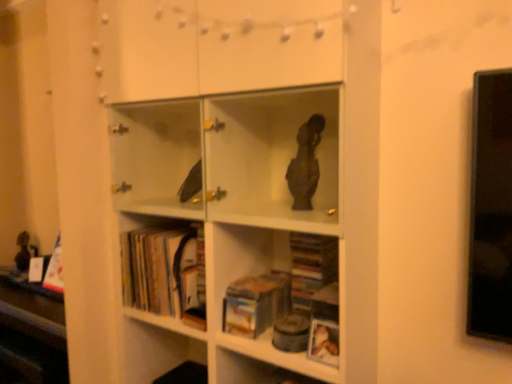
The height and width of the screenshot is (384, 512). Identify the location of hardcover books at lower left, which is the 2th book in right-to-left order. (164, 272).

In the scene shown: In order to face white matte bookcase at center, should I rotate leftwards or rightwards?

To face it directly, rotate left by 2.640 degrees.

Where is `hardcover books at lower left, which is the 1th book in left-to-right order`? hardcover books at lower left, which is the 1th book in left-to-right order is located at coordinates (164, 272).

Who is shorter, white matte bookcase at center or hardcover books at lower left, which is the 2th book in right-to-left order?

Standing shorter between the two is hardcover books at lower left, which is the 2th book in right-to-left order.

Measure the distance from white matte bookcase at center to hardcover books at lower left, which is the 2th book in right-to-left order.

A distance of 7.32 inches exists between white matte bookcase at center and hardcover books at lower left, which is the 2th book in right-to-left order.

Consider the image. Considering the positions of objects white matte bookcase at center and hardcover books at lower left, which is the 1th book in left-to-right order, in the image provided, who is more to the right, white matte bookcase at center or hardcover books at lower left, which is the 1th book in left-to-right order,?

From the viewer's perspective, white matte bookcase at center appears more on the right side.

From a real-world perspective, is white matte bookcase at center positioned over hardcover books at lower left, which is the 2th book in right-to-left order, based on gravity?

Correct, in the physical world, white matte bookcase at center is higher than hardcover books at lower left, which is the 2th book in right-to-left order.

Does point (190, 261) lie in front of point (244, 326)?

No, it is not.

Could hardcover book at center, which ranks as the second book in left-to-right order, be considered to be inside hardcover books at lower left, which is the 2th book in right-to-left order?

Definitely not — hardcover book at center, which ranks as the second book in left-to-right order, is not inside hardcover books at lower left, which is the 2th book in right-to-left order.

Find the location of a particular element. Image resolution: width=512 pixels, height=384 pixels. book on the right side of hardcover books at lower left, which is the 2th book in right-to-left order is located at coordinates (256, 303).

At what (x,y) coordinates should I click in order to perform the action: click on bookcase above the hardcover book at center, positioned as the first book in right-to-left order (from a real-world perspective). Please return your answer as a coordinate pair (x, y). The width and height of the screenshot is (512, 384). Looking at the image, I should click on click(221, 228).

Does white matte bookcase at center have a smaller size compared to hardcover book at center, which ranks as the second book in left-to-right order?

Incorrect, white matte bookcase at center is not smaller in size than hardcover book at center, which ranks as the second book in left-to-right order.

From a real-world perspective, who is located higher, white matte bookcase at center or hardcover book at center, which ranks as the second book in left-to-right order?

white matte bookcase at center, from a real-world perspective.

From the image's perspective, is white matte bookcase at center located above or below hardcover book at center, positioned as the first book in right-to-left order?

From the image's perspective, white matte bookcase at center appears above hardcover book at center, positioned as the first book in right-to-left order.

Is hardcover books at lower left, which is the 2th book in right-to-left order, facing towards white matte bookcase at center?

Yes, hardcover books at lower left, which is the 2th book in right-to-left order, is oriented towards white matte bookcase at center.

In the image, is hardcover books at lower left, which is the 1th book in left-to-right order, positioned in front of or behind white matte bookcase at center?

Clearly, hardcover books at lower left, which is the 1th book in left-to-right order, is behind white matte bookcase at center.

How distant is hardcover books at lower left, which is the 1th book in left-to-right order, from white matte bookcase at center?

hardcover books at lower left, which is the 1th book in left-to-right order, is 7.32 inches away from white matte bookcase at center.

Is hardcover books at lower left, which is the 1th book in left-to-right order, next to white matte bookcase at center?

hardcover books at lower left, which is the 1th book in left-to-right order, and white matte bookcase at center are clearly separated.

Considering the relative positions of hardcover book at center, positioned as the first book in right-to-left order, and white matte bookcase at center in the image provided, is hardcover book at center, positioned as the first book in right-to-left order, in front of white matte bookcase at center?

No, the depth of hardcover book at center, positioned as the first book in right-to-left order, is greater than that of white matte bookcase at center.

From the picture: Is hardcover book at center, positioned as the first book in right-to-left order, at the left side of white matte bookcase at center?

In fact, hardcover book at center, positioned as the first book in right-to-left order, is to the right of white matte bookcase at center.

How distant is hardcover book at center, which ranks as the second book in left-to-right order, from white matte bookcase at center?

The distance of hardcover book at center, which ranks as the second book in left-to-right order, from white matte bookcase at center is 30.43 centimeters.

From the image's perspective, count 2nd books downward from the white matte bookcase at center and point to it. Please provide its 2D coordinates.

[(256, 303)]

From a real-world perspective, is hardcover book at center, positioned as the first book in right-to-left order, above or below hardcover books at lower left, which is the 1th book in left-to-right order?

hardcover book at center, positioned as the first book in right-to-left order, is below hardcover books at lower left, which is the 1th book in left-to-right order.

From the image's perspective, which is below, hardcover book at center, which ranks as the second book in left-to-right order, or hardcover books at lower left, which is the 2th book in right-to-left order?

From the image's view, hardcover book at center, which ranks as the second book in left-to-right order, is below.

Considering the points (263, 302) and (139, 296), which point is behind, point (263, 302) or point (139, 296)?

Point (139, 296)

Considering the relative sizes of hardcover book at center, positioned as the first book in right-to-left order, and hardcover books at lower left, which is the 2th book in right-to-left order, in the image provided, is hardcover book at center, positioned as the first book in right-to-left order, thinner than hardcover books at lower left, which is the 2th book in right-to-left order,?

No.

You are a GUI agent. You are given a task and a screenshot of the screen. Output one action in this format:
    pyautogui.click(x=<x>, y=<y>)
    Task: Click on the bookcase that is above the hardcover books at lower left, which is the 2th book in right-to-left order (from a real-world perspective)
    The height and width of the screenshot is (384, 512).
    Given the screenshot: What is the action you would take?
    pyautogui.click(x=221, y=228)

You are a GUI agent. You are given a task and a screenshot of the screen. Output one action in this format:
    pyautogui.click(x=<x>, y=<y>)
    Task: Click on the book behind the hardcover book at center, positioned as the first book in right-to-left order
    The image size is (512, 384).
    Given the screenshot: What is the action you would take?
    pyautogui.click(x=164, y=272)

In the scene shown: From the image, which object appears to be farther from hardcover book at center, positioned as the first book in right-to-left order, white matte bookcase at center or hardcover books at lower left, which is the 2th book in right-to-left order?

white matte bookcase at center is positioned further to the anchor hardcover book at center, positioned as the first book in right-to-left order.

From the image, which object appears to be farther from hardcover books at lower left, which is the 2th book in right-to-left order, white matte bookcase at center or hardcover book at center, positioned as the first book in right-to-left order?

hardcover book at center, positioned as the first book in right-to-left order.

Estimate the real-world distances between objects in this image. Which object is further from white matte bookcase at center, hardcover books at lower left, which is the 2th book in right-to-left order, or hardcover book at center, positioned as the first book in right-to-left order?

hardcover book at center, positioned as the first book in right-to-left order, is positioned further to the anchor white matte bookcase at center.

From the picture: From the image, which object appears to be farther from hardcover books at lower left, which is the 1th book in left-to-right order, hardcover book at center, positioned as the first book in right-to-left order, or white matte bookcase at center?

hardcover book at center, positioned as the first book in right-to-left order, lies further to hardcover books at lower left, which is the 1th book in left-to-right order, than the other object.

Which object lies further to the anchor point white matte bookcase at center, hardcover book at center, positioned as the first book in right-to-left order, or hardcover books at lower left, which is the 1th book in left-to-right order?

hardcover book at center, positioned as the first book in right-to-left order, is further to white matte bookcase at center.

Estimate the real-world distances between objects in this image. Which object is further from hardcover book at center, which ranks as the second book in left-to-right order, hardcover books at lower left, which is the 1th book in left-to-right order, or white matte bookcase at center?

The object further to hardcover book at center, which ranks as the second book in left-to-right order, is white matte bookcase at center.

Locate an element on the screen. The width and height of the screenshot is (512, 384). book between white matte bookcase at center and hardcover books at lower left, which is the 1th book in left-to-right order, from front to back is located at coordinates (256, 303).